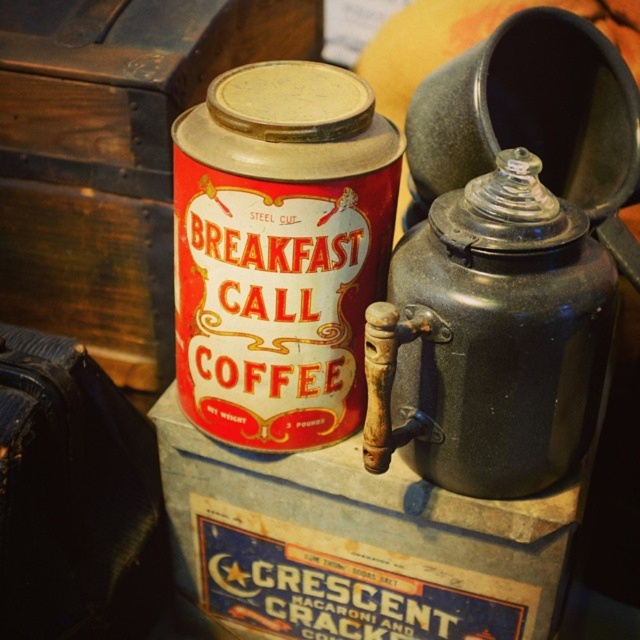
Where is the red matte tin can at center located in the image?

The red matte tin can at center is located at point [280,252].

You are standing in front of a wooden surface with two points marked. The first point is at coordinates point (300,355) and the second is at point (557,442). If you were to look from the front, which point would appear closer to you?

Point (557,442) is closer to you because it is in front of point (300,355).

You are organizing a vintage fair and have a display table. You need to place the red matte tin can at center and the matte black teapot at center right. If the table has limited space, which item should you prioritize keeping to maximize the display area for other items?

The red matte tin can at center is bigger than the matte black teapot at center right, so you should prioritize keeping the matte black teapot at center right to free up more space for other items.